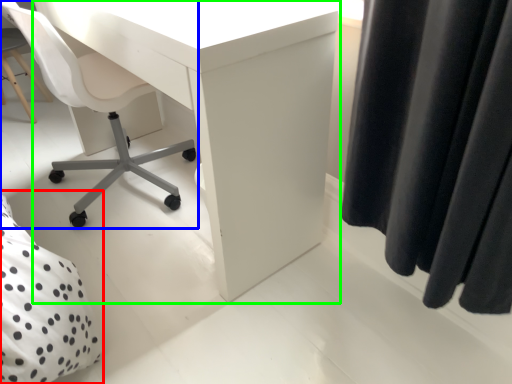
Question: Which object is the farthest from bed (highlighted by a red box)? Choose among these: chair (highlighted by a blue box) or desk (highlighted by a green box).

Choices:
 (A) chair
 (B) desk

Answer: (A)